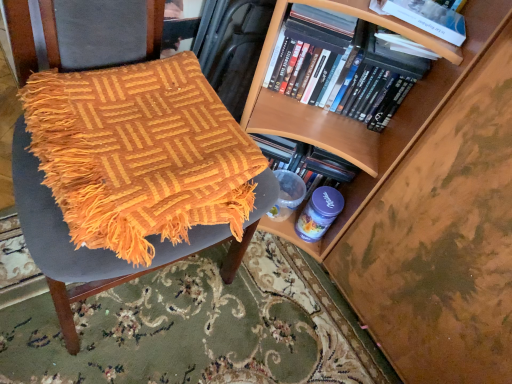
What do you see at coordinates (426, 17) in the screenshot?
I see `hardcover book at upper right, which is the 2th book from back to front` at bounding box center [426, 17].

This screenshot has width=512, height=384. Describe the element at coordinates (339, 64) in the screenshot. I see `black matte dvds at upper right, arranged as the second book when viewed from the front` at that location.

This screenshot has height=384, width=512. I want to click on hardcover book at upper right, which is the 2th book from back to front, so click(426, 17).

Are orange woven blanket at left and hardcover book at upper right making contact?

orange woven blanket at left is not next to hardcover book at upper right, and they're not touching.

Is orange woven blanket at left inside or outside of hardcover book at upper right?

The correct answer is: outside.

Does orange woven blanket at left turn towards hardcover book at upper right?

No, orange woven blanket at left is not aimed at hardcover book at upper right.

Is point (402, 3) positioned after point (312, 13)?

No, (402, 3) is in front of (312, 13).

How distant is hardcover book at upper right, which is the 2th book from back to front, from hardcover book at upper right?

A distance of 5.33 inches exists between hardcover book at upper right, which is the 2th book from back to front, and hardcover book at upper right.

Considering the relative sizes of hardcover book at upper right, which is the 2th book from back to front, and hardcover book at upper right in the image provided, is hardcover book at upper right, which is the 2th book from back to front, bigger than hardcover book at upper right?

Incorrect, hardcover book at upper right, which is the 2th book from back to front, is not larger than hardcover book at upper right.

Looking at this image, from the image's perspective, between hardcover book at upper right, which appears as the 1th book when viewed from the front, and hardcover book at upper right, who is located below?

From the image's view, hardcover book at upper right, which appears as the 1th book when viewed from the front, is below.

Is black matte dvds at upper right, the first book positioned from the back, completely or partially outside of orange woven blanket at left?

Absolutely, black matte dvds at upper right, the first book positioned from the back, is external to orange woven blanket at left.

Looking at this image, how many degrees apart are the facing directions of black matte dvds at upper right, the first book positioned from the back, and orange woven blanket at left?

The angular difference between black matte dvds at upper right, the first book positioned from the back, and orange woven blanket at left is 46.5 degrees.

Find the location of a particular element. The width and height of the screenshot is (512, 384). book that is the 1st one when counting rightward from the orange woven blanket at left is located at coordinates (339, 64).

Which object is closer to the camera taking this photo, black matte dvds at upper right, arranged as the second book when viewed from the front, or orange woven blanket at left?

orange woven blanket at left is closer to the camera.

Between hardcover book at upper right, which is the 2th book from back to front, and black matte dvds at upper right, arranged as the second book when viewed from the front, which one has smaller width?

hardcover book at upper right, which is the 2th book from back to front.

Which of these two, hardcover book at upper right, which appears as the 1th book when viewed from the front, or black matte dvds at upper right, arranged as the second book when viewed from the front, stands taller?

Standing taller between the two is black matte dvds at upper right, arranged as the second book when viewed from the front.

From the image's perspective, does hardcover book at upper right, which appears as the 1th book when viewed from the front, appear higher than black matte dvds at upper right, arranged as the second book when viewed from the front?

Yes, from the image's perspective, hardcover book at upper right, which appears as the 1th book when viewed from the front, is on top of black matte dvds at upper right, arranged as the second book when viewed from the front.

How different are the orientations of hardcover book at upper right, which is the 2th book from back to front, and black matte dvds at upper right, the first book positioned from the back, in degrees?

They differ by 3.24 degrees in their facing directions.

From the image's perspective, who appears lower, hardcover book at upper right or hardcover book at upper right, which is the 2th book from back to front?

hardcover book at upper right, which is the 2th book from back to front, appears lower in the image.

Is hardcover book at upper right oriented towards hardcover book at upper right, which is the 2th book from back to front?

No, hardcover book at upper right is not facing towards hardcover book at upper right, which is the 2th book from back to front.

Considering the relative positions of hardcover book at upper right and hardcover book at upper right, which is the 2th book from back to front, in the image provided, is hardcover book at upper right to the right of hardcover book at upper right, which is the 2th book from back to front, from the viewer's perspective?

No.

Consider the image. Can you confirm if hardcover book at upper right is bigger than hardcover book at upper right, which appears as the 1th book when viewed from the front?

Indeed, hardcover book at upper right has a larger size compared to hardcover book at upper right, which appears as the 1th book when viewed from the front.

How many degrees apart are the facing directions of black matte dvds at upper right, the first book positioned from the back, and hardcover book at upper right, which appears as the 1th book when viewed from the front?

The angle between the facing direction of black matte dvds at upper right, the first book positioned from the back, and the facing direction of hardcover book at upper right, which appears as the 1th book when viewed from the front, is 3.24 degrees.

In order to click on book located on the right of black matte dvds at upper right, the first book positioned from the back in this screenshot , I will do `click(426, 17)`.

Does black matte dvds at upper right, the first book positioned from the back, have a lesser height compared to hardcover book at upper right, which appears as the 1th book when viewed from the front?

No, black matte dvds at upper right, the first book positioned from the back, is not shorter than hardcover book at upper right, which appears as the 1th book when viewed from the front.

Does black matte dvds at upper right, the first book positioned from the back, come in front of hardcover book at upper right, which appears as the 1th book when viewed from the front?

No, black matte dvds at upper right, the first book positioned from the back, is further to the viewer.

Can you confirm if orange woven blanket at left is wider than hardcover book at upper right, which is the 2th book from back to front?

Indeed, orange woven blanket at left has a greater width compared to hardcover book at upper right, which is the 2th book from back to front.

Relative to hardcover book at upper right, which is the 2th book from back to front, is orange woven blanket at left in front or behind?

In the image, orange woven blanket at left appears in front of hardcover book at upper right, which is the 2th book from back to front.

From a real-world perspective, is orange woven blanket at left on hardcover book at upper right, which is the 2th book from back to front?

No, from a real-world perspective, orange woven blanket at left is not on top of hardcover book at upper right, which is the 2th book from back to front.

Find the location of a particular element. The width and height of the screenshot is (512, 384). chair located underneath the hardcover book at upper right, which appears as the 1th book when viewed from the front (from a real-world perspective) is located at coordinates (31, 33).

This screenshot has height=384, width=512. Find the location of `chair lying below the hardcover book at upper right (from the image's perspective)`. chair lying below the hardcover book at upper right (from the image's perspective) is located at coordinates (31, 33).

This screenshot has height=384, width=512. In order to click on paperback book located behind the hardcover book at upper right, which is the 2th book from back to front in this screenshot , I will do (325, 19).

When comparing their distances from hardcover book at upper right, which is the 2th book from back to front, does orange woven blanket at left or black matte dvds at upper right, arranged as the second book when viewed from the front, seem closer?

black matte dvds at upper right, arranged as the second book when viewed from the front, is positioned closer to the anchor hardcover book at upper right, which is the 2th book from back to front.

Estimate the real-world distances between objects in this image. Which object is closer to orange woven blanket at left, black matte dvds at upper right, arranged as the second book when viewed from the front, or hardcover book at upper right?

black matte dvds at upper right, arranged as the second book when viewed from the front, is positioned closer to the anchor orange woven blanket at left.

Based on the photo, estimate the real-world distances between objects in this image. Which object is further from black matte dvds at upper right, arranged as the second book when viewed from the front, hardcover book at upper right, which appears as the 1th book when viewed from the front, or hardcover book at upper right?

hardcover book at upper right, which appears as the 1th book when viewed from the front, is further to black matte dvds at upper right, arranged as the second book when viewed from the front.

Considering their positions, is hardcover book at upper right, which is the 2th book from back to front, positioned further to orange woven blanket at left than black matte dvds at upper right, arranged as the second book when viewed from the front?

Among the two, hardcover book at upper right, which is the 2th book from back to front, is located further to orange woven blanket at left.

Which object lies further to the anchor point black matte dvds at upper right, the first book positioned from the back, hardcover book at upper right or orange woven blanket at left?

Among the two, orange woven blanket at left is located further to black matte dvds at upper right, the first book positioned from the back.

Which object lies further to the anchor point black matte dvds at upper right, the first book positioned from the back, hardcover book at upper right or hardcover book at upper right, which is the 2th book from back to front?

hardcover book at upper right, which is the 2th book from back to front, is positioned further to the anchor black matte dvds at upper right, the first book positioned from the back.

Based on their spatial positions, is black matte dvds at upper right, the first book positioned from the back, or orange woven blanket at left further from hardcover book at upper right?

orange woven blanket at left is further to hardcover book at upper right.

Considering their positions, is black matte dvds at upper right, the first book positioned from the back, positioned closer to hardcover book at upper right than hardcover book at upper right, which is the 2th book from back to front?

black matte dvds at upper right, the first book positioned from the back.

Identify the location of paperback book located between orange woven blanket at left and black matte dvds at upper right, the first book positioned from the back, in the left-right direction. Image resolution: width=512 pixels, height=384 pixels. (325, 19).

At what (x,y) coordinates should I click in order to perform the action: click on paperback book between hardcover book at upper right, which appears as the 1th book when viewed from the front, and black matte dvds at upper right, arranged as the second book when viewed from the front, from front to back. Please return your answer as a coordinate pair (x, y). Looking at the image, I should click on (325, 19).

Where is `book between orange woven blanket at left and hardcover book at upper right, which appears as the 1th book when viewed from the front`? This screenshot has width=512, height=384. book between orange woven blanket at left and hardcover book at upper right, which appears as the 1th book when viewed from the front is located at coordinates [x=339, y=64].

The image size is (512, 384). I want to click on paperback book located between orange woven blanket at left and hardcover book at upper right, which is the 2th book from back to front, in the left-right direction, so click(x=325, y=19).